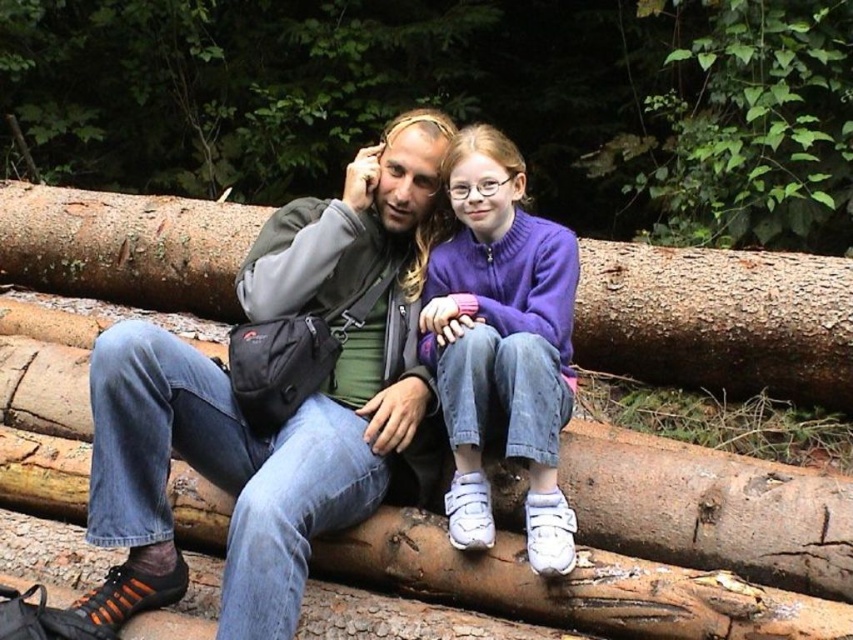
Looking at this image, measure the distance between brown rough log at center and camera.

A distance of 7.74 meters exists between brown rough log at center and camera.

What do you see at coordinates (451, 102) in the screenshot? I see `brown rough log at center` at bounding box center [451, 102].

This screenshot has height=640, width=853. What are the coordinates of `brown rough log at center` in the screenshot? It's located at (451, 102).

Is brown rough log at center to the right of denim jeans at center from the viewer's perspective?

Incorrect, brown rough log at center is not on the right side of denim jeans at center.

Does brown rough log at center have a larger size compared to denim jeans at center?

Yes, brown rough log at center is bigger than denim jeans at center.

Does point (399, 3) come farther from viewer compared to point (368, 280)?

Yes, it is.

At what (x,y) coordinates should I click in order to perform the action: click on brown rough log at center. Please return your answer as a coordinate pair (x, y). This screenshot has width=853, height=640. Looking at the image, I should click on (451, 102).

Does denim jeans at center appear over purple fleece sweater at center?

Indeed, denim jeans at center is positioned over purple fleece sweater at center.

Which is below, denim jeans at center or purple fleece sweater at center?

purple fleece sweater at center

Image resolution: width=853 pixels, height=640 pixels. What are the coordinates of `denim jeans at center` in the screenshot? It's located at (293, 413).

Locate an element on the screen. denim jeans at center is located at coordinates (293, 413).